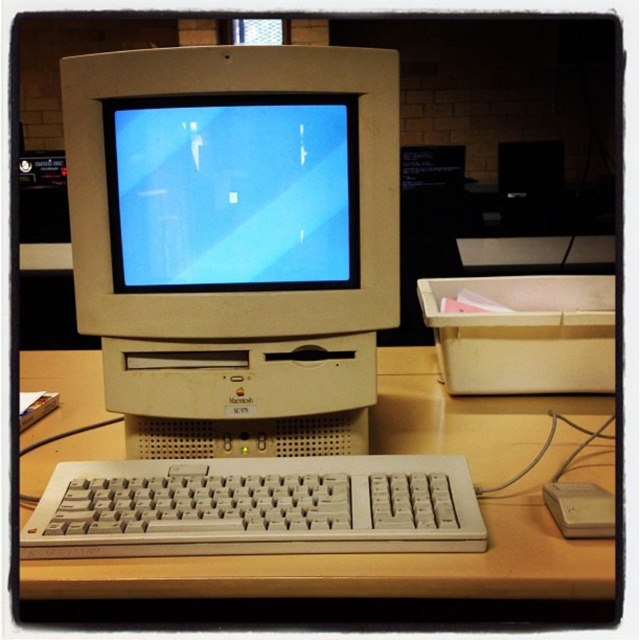
Question: Among these points, which one is nearest to the camera?

Choices:
 (A) (609, 577)
 (B) (336, 355)
 (C) (189, 198)
 (D) (307, 490)

Answer: (A)

Question: From the image, what is the correct spatial relationship of beige plastic monitor at center in relation to beige plastic mouse at lower right?

Choices:
 (A) right
 (B) left

Answer: (B)

Question: Which point appears farthest from the camera in this image?

Choices:
 (A) (584, 492)
 (B) (198, 227)
 (C) (196, 508)

Answer: (B)

Question: Is beige plastic monitor at center closer to the viewer compared to beige plastic mouse at lower right?

Choices:
 (A) yes
 (B) no

Answer: (B)

Question: Estimate the real-world distances between objects in this image. Which object is farther from the beige plastic mouse at lower right?

Choices:
 (A) beige plastic keyboard at lower center
 (B) matte plastic monitor at center

Answer: (B)

Question: Does beige plastic keyboard at center appear over beige plastic mouse at lower right?

Choices:
 (A) yes
 (B) no

Answer: (A)